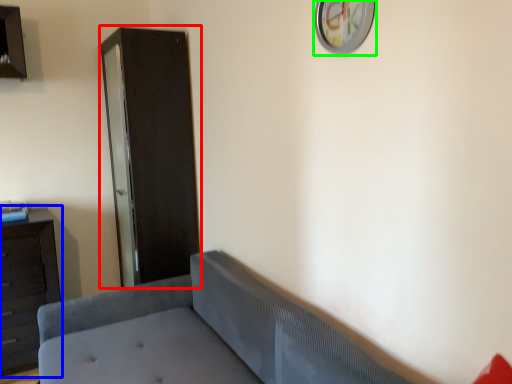
Question: Which is farther away from file cabinet (highlighted by a red box)? dresser (highlighted by a blue box) or clock (highlighted by a green box)?

Choices:
 (A) dresser
 (B) clock

Answer: (B)